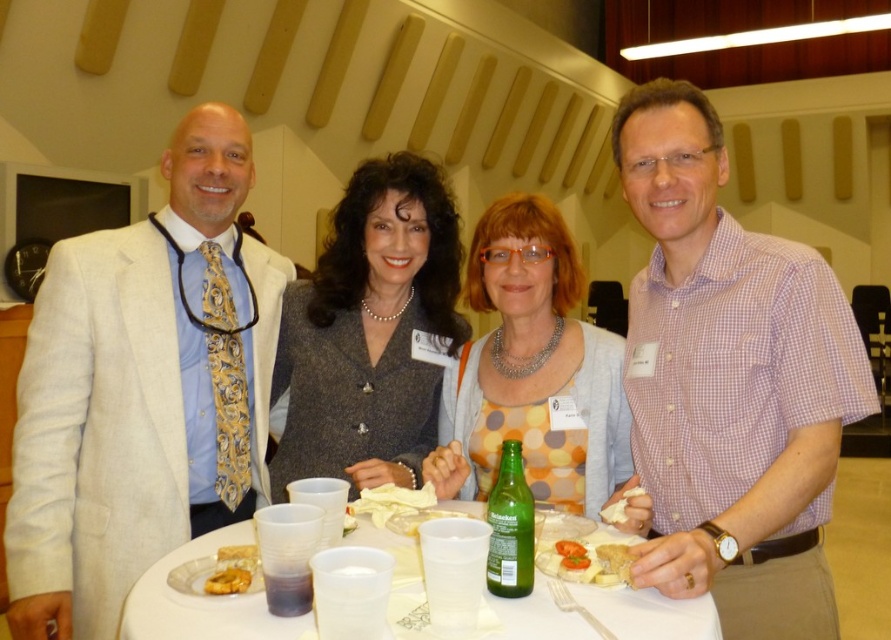
This screenshot has height=640, width=891. I want to click on light beige suit at left, so click(x=142, y=390).

Between light beige suit at left and purple checkered shirt at right, which one appears on the right side from the viewer's perspective?

purple checkered shirt at right

Does point (101, 451) lie in front of point (797, 550)?

No, (101, 451) is further to viewer.

You are a GUI agent. You are given a task and a screenshot of the screen. Output one action in this format:
    pyautogui.click(x=<x>, y=<y>)
    Task: Click on the light beige suit at left
    
    Given the screenshot: What is the action you would take?
    pyautogui.click(x=142, y=390)

Which of these two, green glass bottle at center or golden crumbly pastry at center, stands shorter?

With less height is golden crumbly pastry at center.

Is green glass bottle at center thinner than golden crumbly pastry at center?

No, green glass bottle at center is not thinner than golden crumbly pastry at center.

The image size is (891, 640). What do you see at coordinates (511, 528) in the screenshot?
I see `green glass bottle at center` at bounding box center [511, 528].

Where is `green glass bottle at center`? The width and height of the screenshot is (891, 640). green glass bottle at center is located at coordinates (511, 528).

Consider the image. Is pearl necklace at center wider than golden brown bread at center?

Indeed, pearl necklace at center has a greater width compared to golden brown bread at center.

Between pearl necklace at center and golden brown bread at center, which one has more height?

Standing taller between the two is pearl necklace at center.

At what (x,y) coordinates should I click in order to perform the action: click on pearl necklace at center. Please return your answer as a coordinate pair (x, y). Looking at the image, I should click on (369, 332).